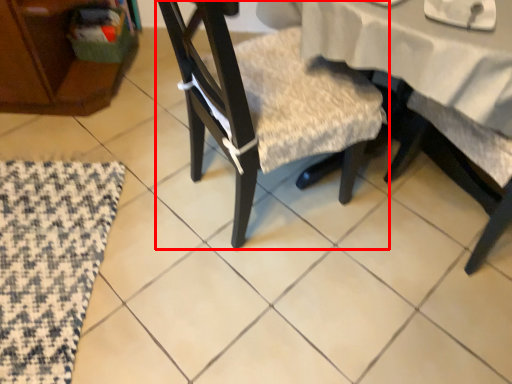
Question: From the image, what is the correct spatial relationship of chair (annotated by the red box) in relation to mat?

Choices:
 (A) right
 (B) left

Answer: (A)